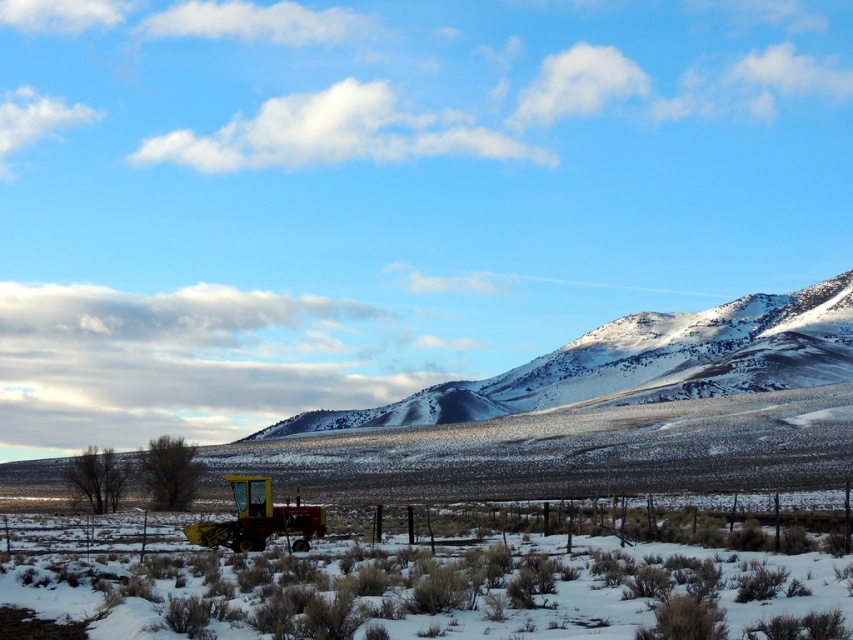
You are a farmer standing at the base of the snowy rocky mountain at center and want to drive the red matte tractor at lower left to the top. Considering the tractor and mountain sizes, is this feasible?

The snowy rocky mountain at center is taller than the red matte tractor at lower left, but the tractor is designed for such terrain, so it might be possible with careful navigation.

From the picture: You are standing at the point closer to the camera in this rural landscape scene. Which point are you standing at, point (463, 413) or point (244, 513)?

You are standing at point (244, 513) because it is closer to the camera than point (463, 413).

From the picture: You are a farmer who needs to drive your red matte tractor at lower left to the snowy rocky mountain at center to clear snow. Can you reach the mountain directly from your current position?

The snowy rocky mountain at center is positioned on the right side of red matte tractor at lower left, so you can drive the red matte tractor at lower left directly towards the snowy rocky mountain at center as it is located to the right of the tractor.